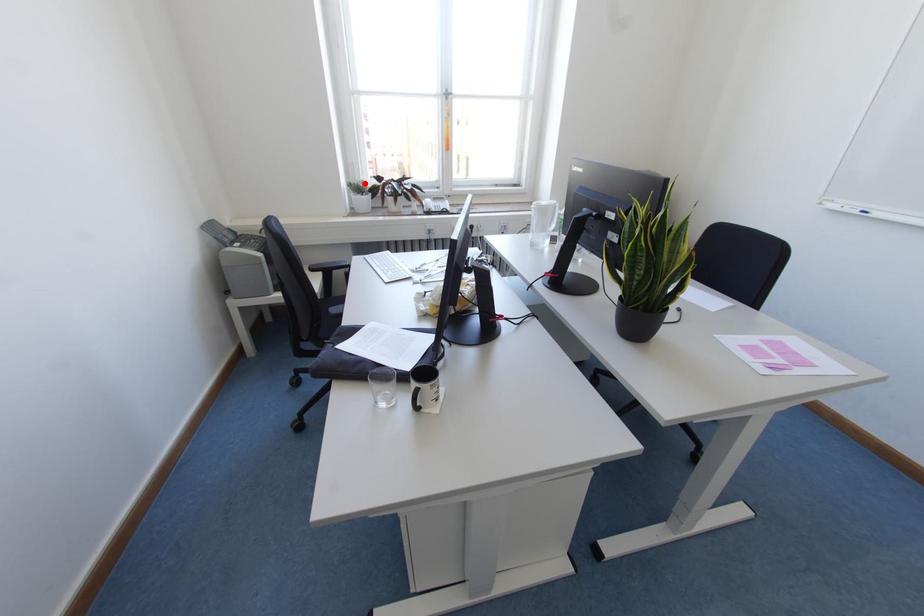
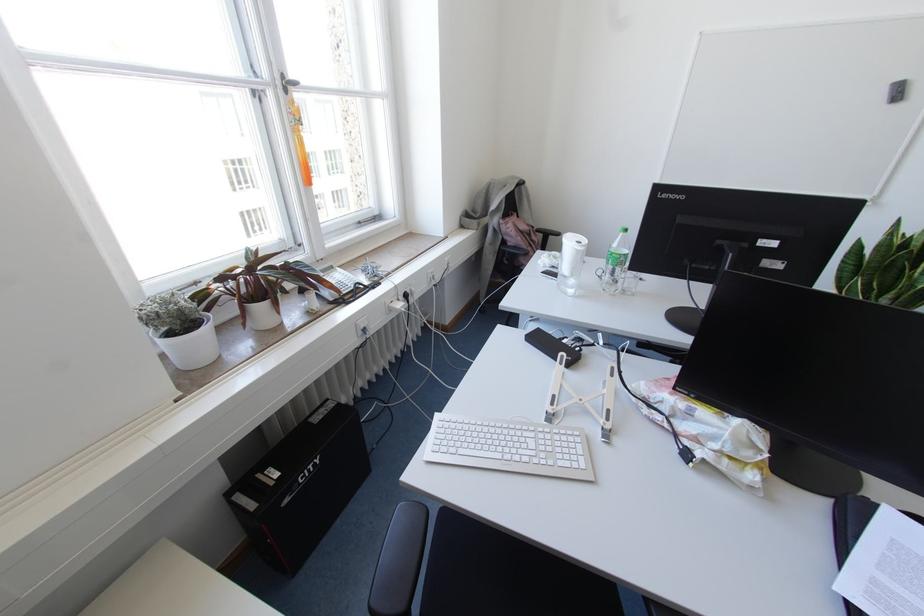
Question: I am providing you with two images of the same scene from different viewpoints. Given a red point in image1, look at the same physical point in image2. Is it:

Choices:
 (A) Closer to the viewpoint
 (B) Farther from the viewpoint

Answer: (B)